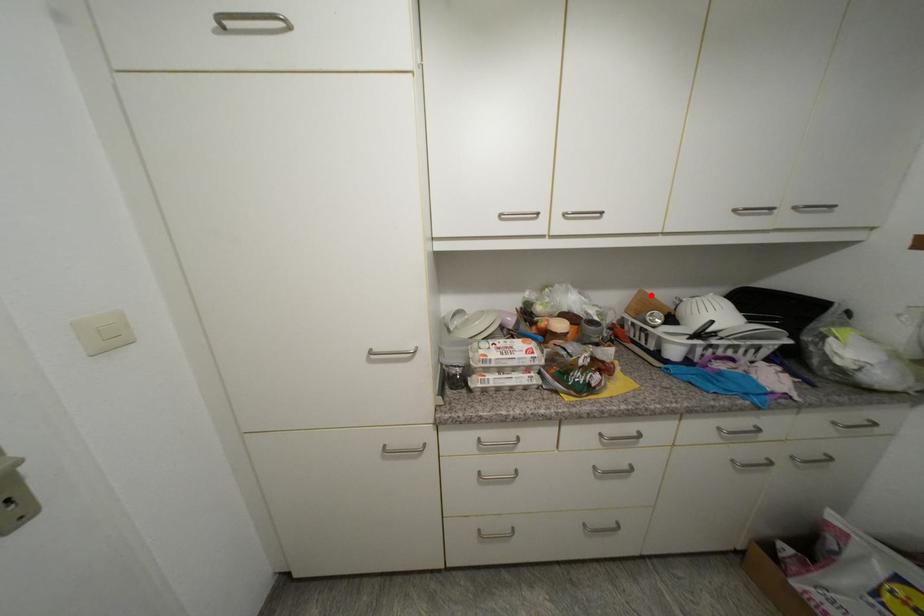
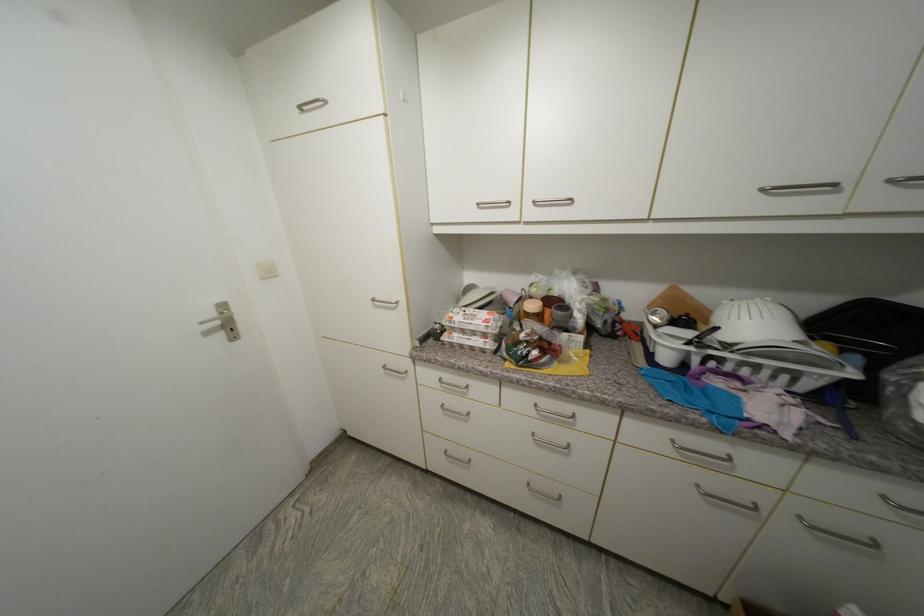
In the second image, find the point that corresponds to the highlighted location in the first image.

(685, 292)